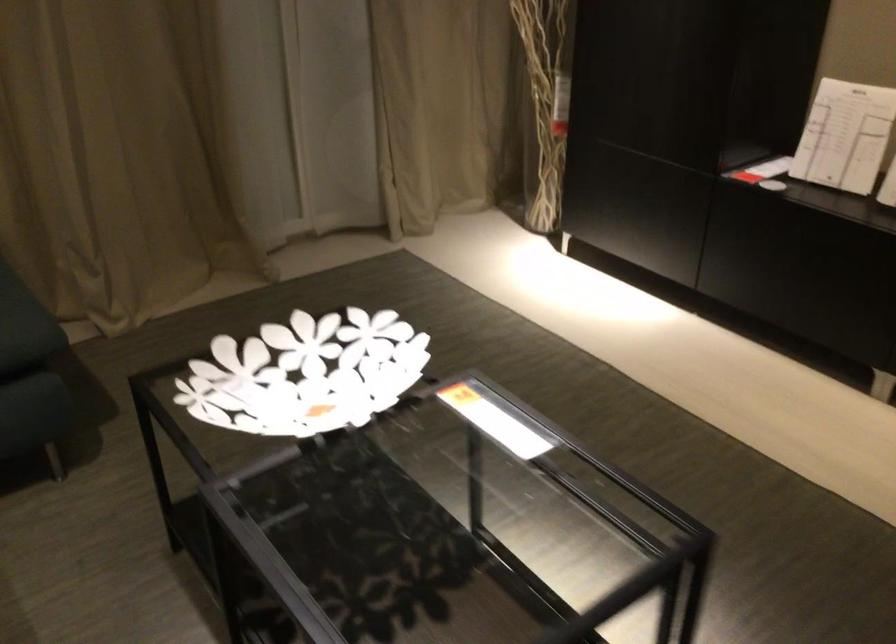
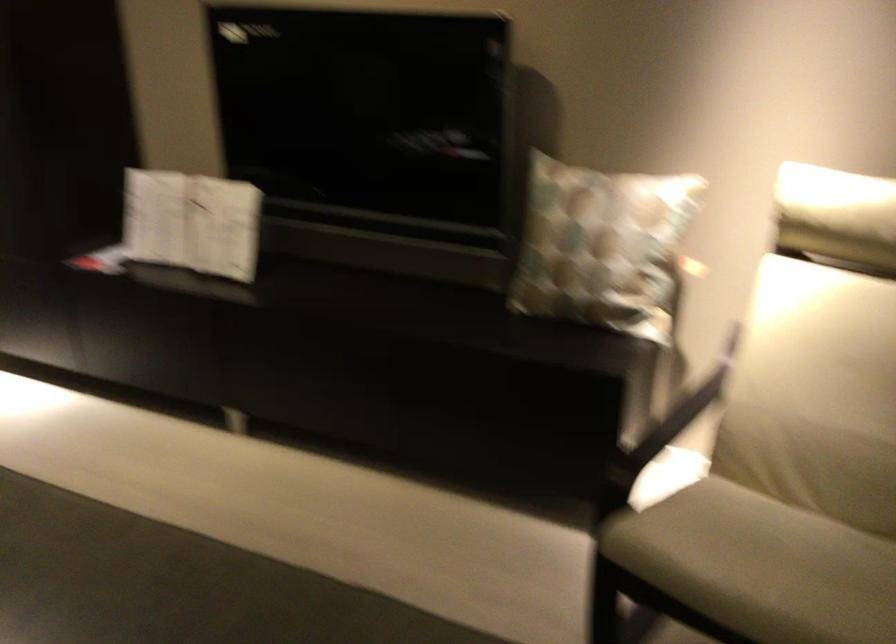
Question: Based on the continuous images, in which direction is the camera rotating? Reply with the corresponding letter.

Choices:
 (A) Left
 (B) Right
 (C) Up
 (D) Down

Answer: (B)